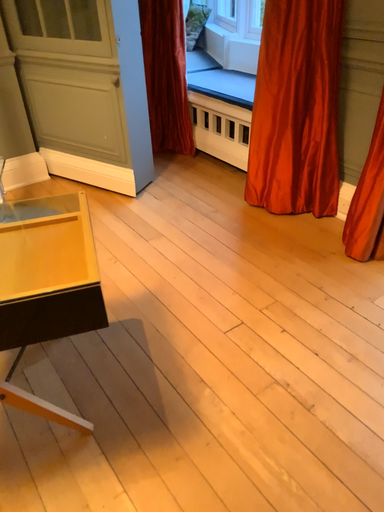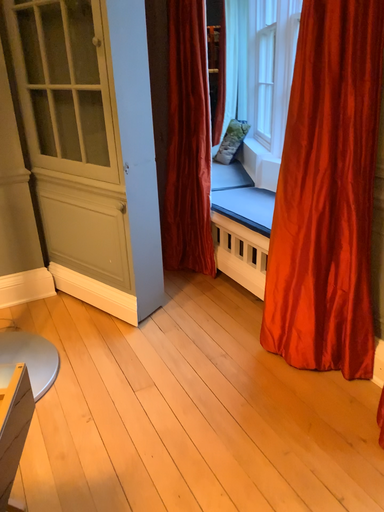
Question: Which way did the camera rotate in the video?

Choices:
 (A) rotated right
 (B) rotated left

Answer: (B)